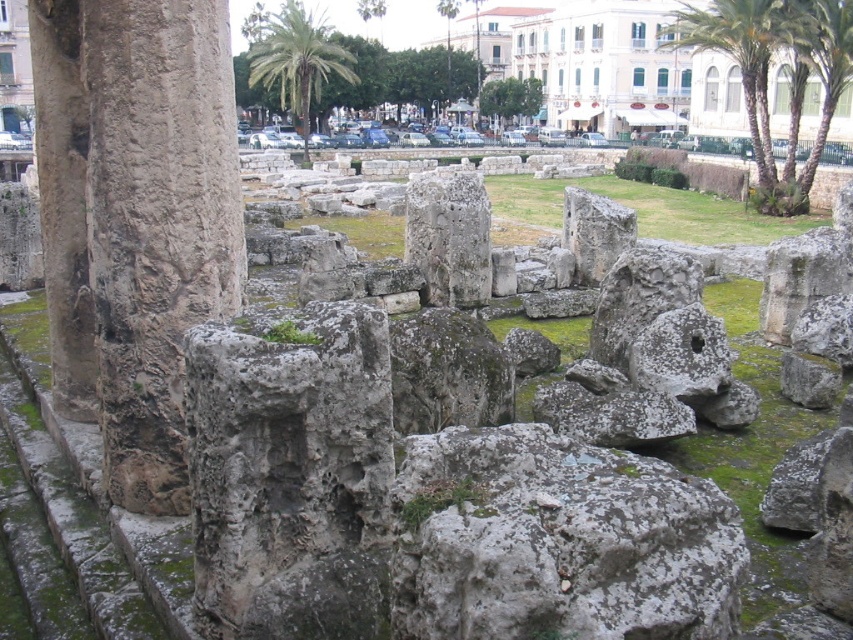
You are a tour guide leading a group at the archaeological site. You want to point out the green grass at center and the green leafy palm tree at upper center to your tourists. Which one is closer to your current position?

The green grass at center is closer to your current position because it is only 52.82 meters away from the green leafy palm tree at upper center, meaning the grass is nearer to you than the palm tree.

You are a tour guide explaining the archaeological site to visitors. You point out the green grass at center and the green leafy palm tree at upper center. Which of these two has a smaller width?

The green grass at center has a smaller width than the green leafy palm tree at upper center.